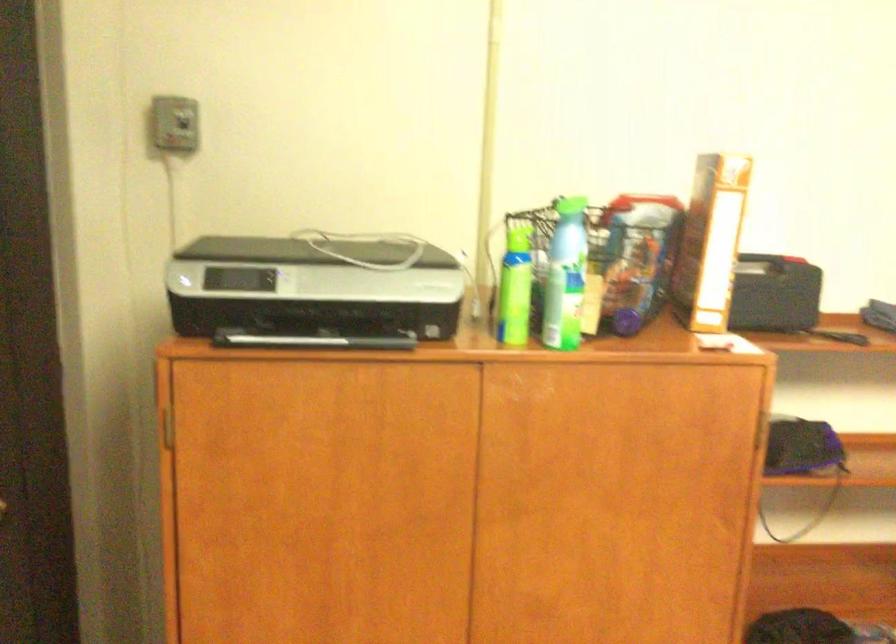
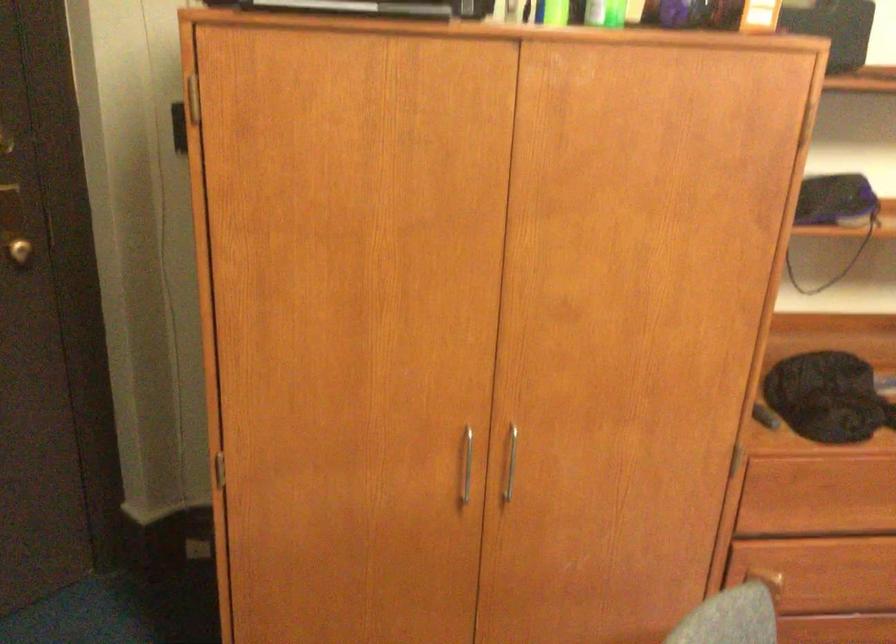
Locate, in the second image, the point that corresponds to the point at 517,327 in the first image.

(556, 13)